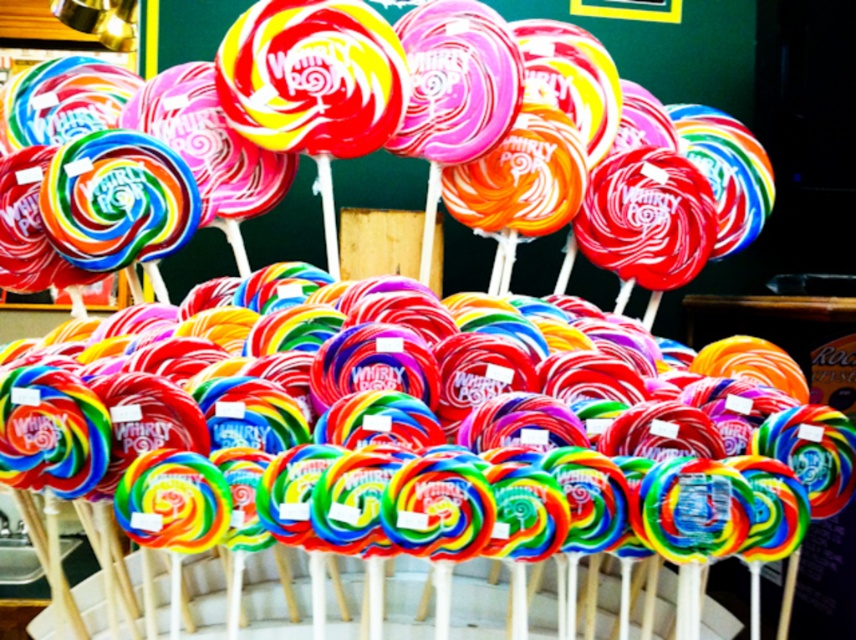
Question: Is rainbow swirl lollipop at center below swirled candy at center?

Choices:
 (A) no
 (B) yes

Answer: (B)

Question: Among these points, which one is nearest to the camera?

Choices:
 (A) (619, 40)
 (B) (831, 497)

Answer: (B)

Question: Does rainbow swirl lollipop at center have a greater width compared to swirled candy at center?

Choices:
 (A) no
 (B) yes

Answer: (A)

Question: Among these objects, which one is farthest from the camera?

Choices:
 (A) swirled candy at center
 (B) rainbow swirl lollipop at center

Answer: (A)

Question: Where is rainbow swirl lollipop at center located in relation to swirled candy at center in the image?

Choices:
 (A) right
 (B) left

Answer: (B)

Question: Which of the following is the closest to the observer?

Choices:
 (A) (654, 84)
 (B) (218, 445)

Answer: (B)